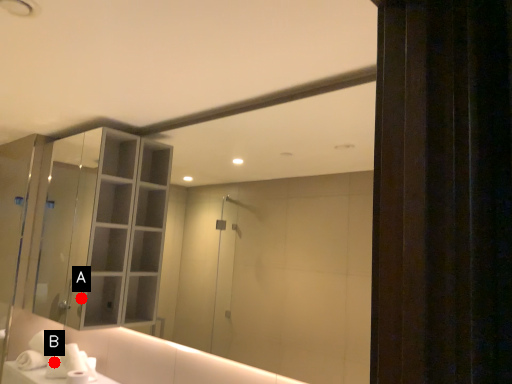
Question: Two points are circled on the image, labeled by A and B beside each circle. Which point is closer to the camera?

Choices:
 (A) A is closer
 (B) B is closer

Answer: (A)